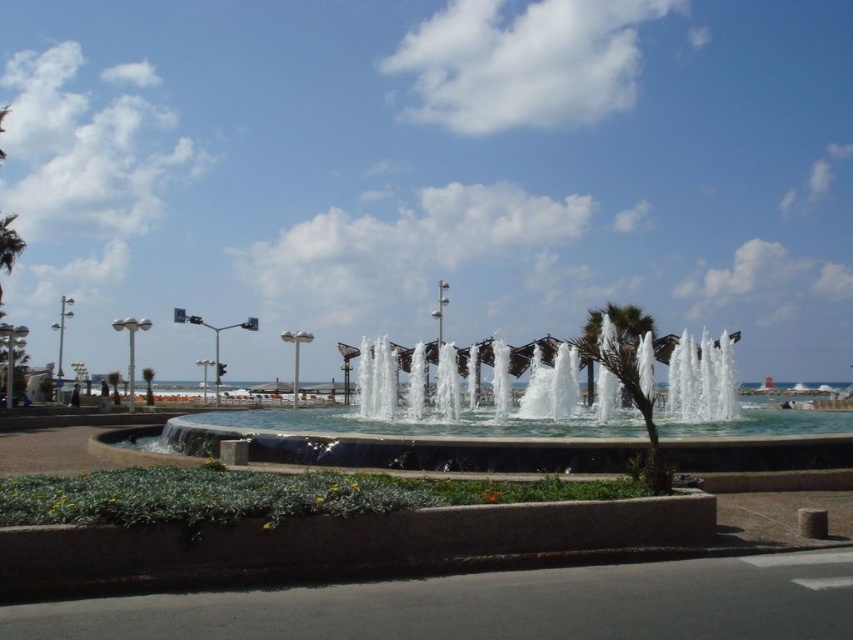
Who is more distant from viewer, [199,426] or [622,328]?

The point [622,328] is more distant.

Where is `concrete fountain at center`? The image size is (853, 640). concrete fountain at center is located at coordinates (410, 440).